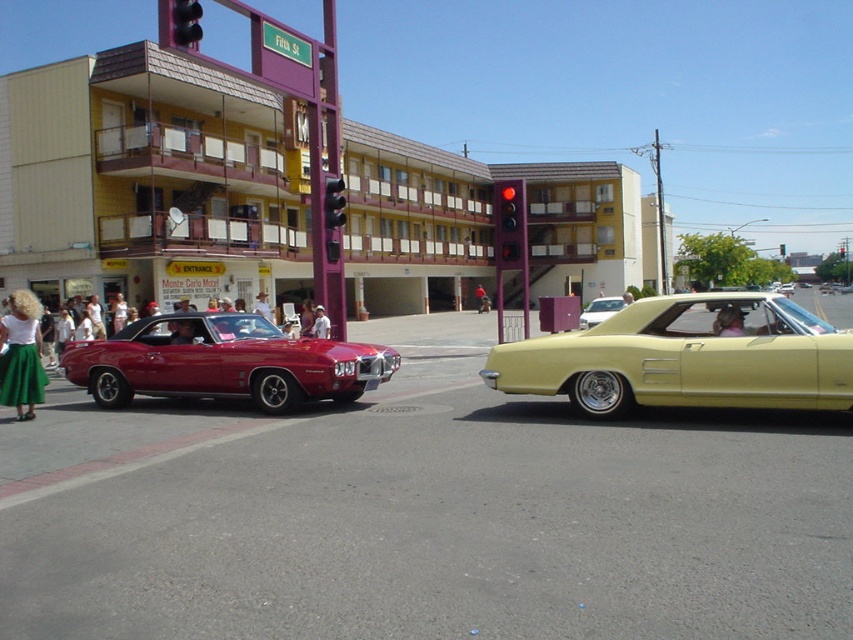
Question: Based on their relative distances, which object is farther from the matte yellow convertible at right?

Choices:
 (A) metallic red traffic light at upper center
 (B) red glass traffic light at center
 (C) metallic gold car at center
 (D) matte red car at left

Answer: (C)

Question: Can you confirm if red glass traffic light at center is bigger than metallic traffic light at center?

Choices:
 (A) no
 (B) yes

Answer: (B)

Question: From the image, what is the correct spatial relationship of matte yellow convertible at right in relation to matte red car at left?

Choices:
 (A) below
 (B) above

Answer: (B)

Question: Based on their relative distances, which object is farther from the metallic gold car at center?

Choices:
 (A) matte yellow convertible at right
 (B) metallic traffic light at center
 (C) metallic red traffic light at upper center

Answer: (A)

Question: Which of these objects is positioned farthest from the metallic traffic light at center?

Choices:
 (A) metallic gold car at center
 (B) metallic red traffic light at upper center
 (C) matte yellow convertible at right

Answer: (C)

Question: Is matte red car at left smaller than red glass traffic light at center?

Choices:
 (A) yes
 (B) no

Answer: (A)